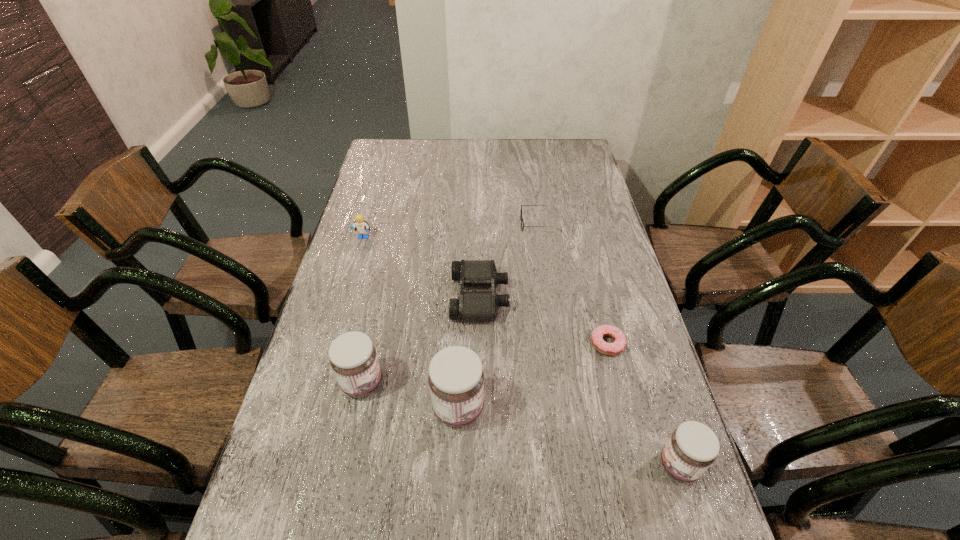
You are a GUI agent. You are given a task and a screenshot of the screen. Output one action in this format:
    pyautogui.click(x=<x>, y=<y>)
    Task: Click on the Lego
    The width and height of the screenshot is (960, 540).
    Given the screenshot: What is the action you would take?
    pyautogui.click(x=361, y=226)

Find the location of `doughnut`. doughnut is located at coordinates (611, 349).

The image size is (960, 540). Identify the location of the shortest object. (611, 349).

Find the location of a particular element. The image size is (960, 540). vacant space situated 0.290m on the front label of the second tallest jam is located at coordinates (499, 383).

Identify the location of free space located on the front label of the second jam from left to right. This screenshot has width=960, height=540. (576, 408).

I want to click on free point located on the front label of the fifth shortest object, so click(590, 465).

Where is `vacant space located 0.260m on the front label of the fifth shortest object`? vacant space located 0.260m on the front label of the fifth shortest object is located at coordinates (540, 465).

Image resolution: width=960 pixels, height=540 pixels. What are the coordinates of `free space located 0.120m on the front label of the fifth shortest object` in the screenshot? It's located at (604, 465).

Where is `free region located 0.190m through the lenses of the spectacles`? The height and width of the screenshot is (540, 960). free region located 0.190m through the lenses of the spectacles is located at coordinates (467, 224).

At what (x,y) coordinates should I click in order to perform the action: click on free space located 0.050m through the lenses of the spectacles. Please return your answer as a coordinate pair (x, y). Looking at the image, I should click on (506, 224).